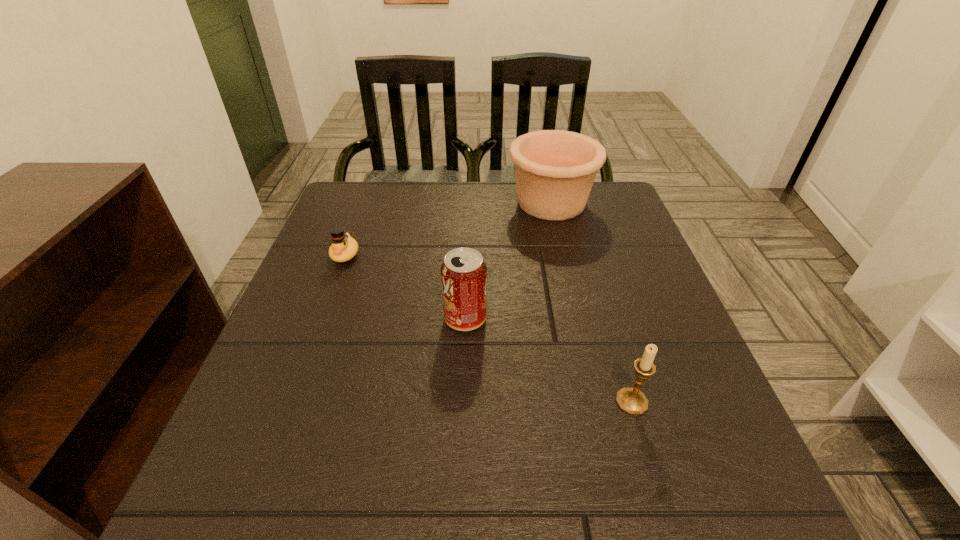
Image resolution: width=960 pixels, height=540 pixels. I want to click on pottery, so click(x=555, y=170).

Locate an element on the screen. the third farthest object is located at coordinates (463, 273).

At what (x,y) coordinates should I click in order to perform the action: click on the third object from right to left. Please return your answer as a coordinate pair (x, y). The height and width of the screenshot is (540, 960). Looking at the image, I should click on (463, 273).

Locate an element on the screen. candle holder is located at coordinates (631, 400).

I want to click on the shortest object, so click(343, 247).

In order to click on duck in this screenshot , I will do `click(343, 247)`.

Locate an element on the screen. This screenshot has width=960, height=540. blank space located on the left of the pottery is located at coordinates (413, 202).

Locate an element on the screen. vacant region located 0.230m on the back of the second nearest object is located at coordinates (468, 239).

Where is `vacant space located 0.360m on the left of the candle holder`? vacant space located 0.360m on the left of the candle holder is located at coordinates (401, 401).

The image size is (960, 540). I want to click on vacant space situated 0.240m on the front-facing side of the leftmost object, so click(310, 351).